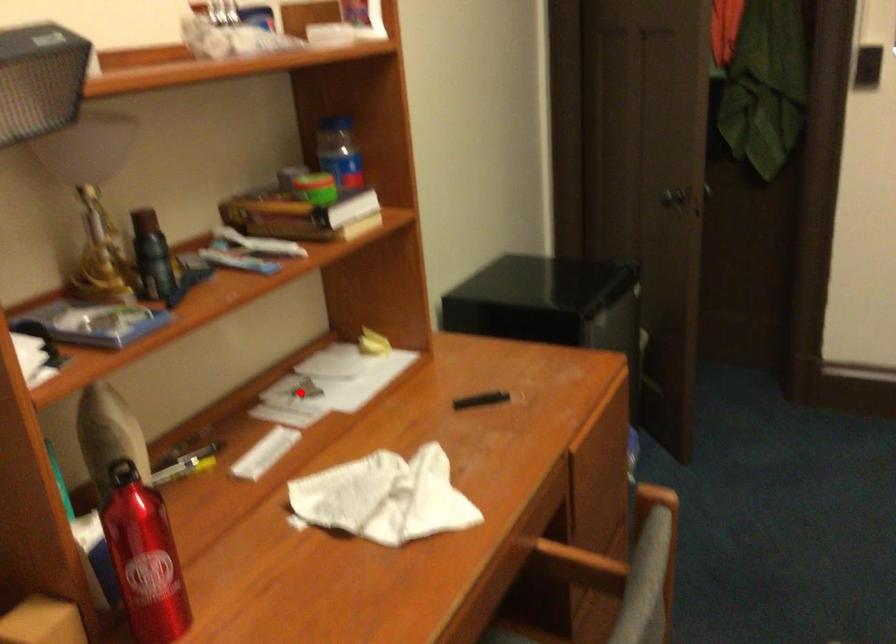
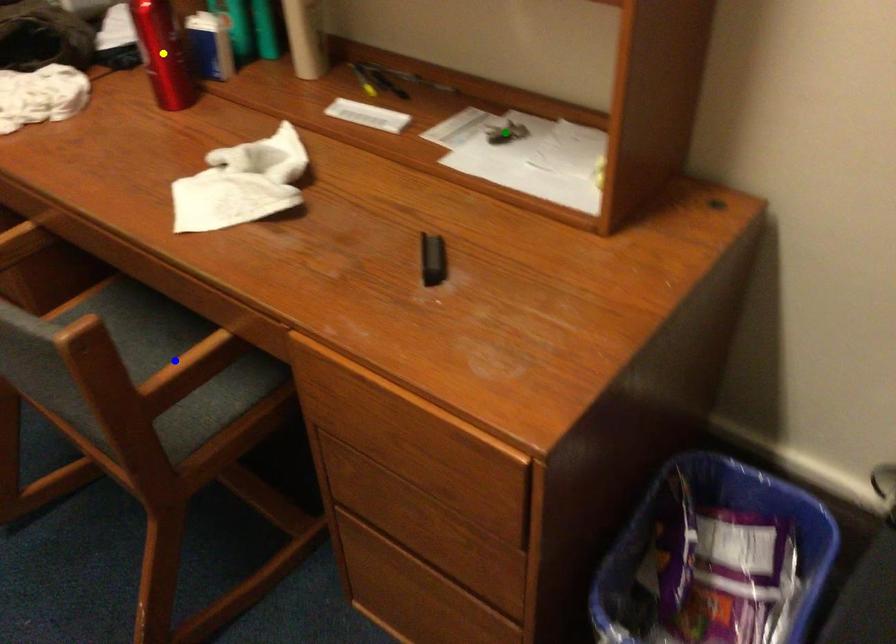
Question: I am providing you with two images of the same scene from different viewpoints. A red point is marked on the first image. You are given multiple points on the second image. Which point in image 2 is actually the same real-world point as the red point in image 1?

Choices:
 (A) yellow point
 (B) green point
 (C) blue point

Answer: (B)